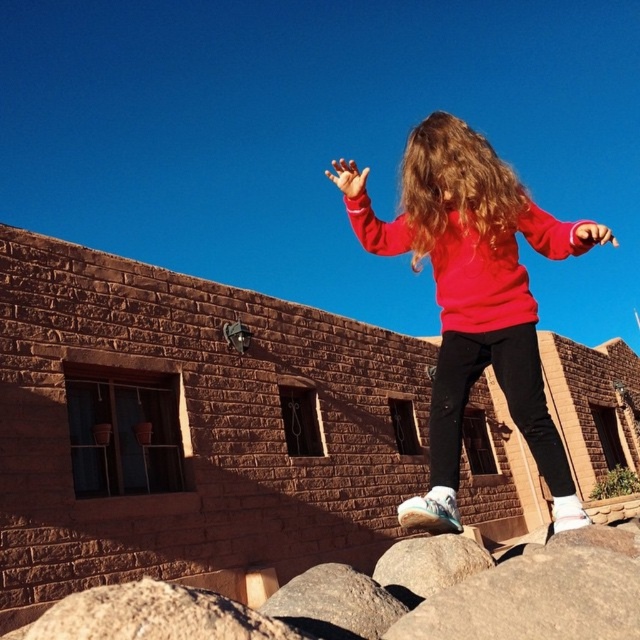
In the scene shown: Who is lower down, matte red sweatshirt at center or matte pink hand at upper right?

matte red sweatshirt at center is lower down.

Who is more forward, (538, 355) or (600, 234)?

Positioned in front is point (600, 234).

Where is `matte red sweatshirt at center`? matte red sweatshirt at center is located at coordinates (474, 301).

Between matte red sweatshirt at center and blonde silky hair at center, which one has more height?

blonde silky hair at center

Is matte red sweatshirt at center closer to the viewer compared to blonde silky hair at center?

Yes, it is.

Describe the element at coordinates (474, 301) in the screenshot. I see `matte red sweatshirt at center` at that location.

Where is `matte red sweatshirt at center`? The width and height of the screenshot is (640, 640). matte red sweatshirt at center is located at coordinates (474, 301).

Who is more distant from viewer, (413, 180) or (611, 234)?

The point (413, 180) is more distant.

Looking at this image, between blonde silky hair at center and matte pink hand at upper right, which one is positioned higher?

matte pink hand at upper right

Between point (438, 124) and point (600, 236), which one is positioned in front?

Point (600, 236) is more forward.

Find the location of a particular element. blonde silky hair at center is located at coordinates (456, 184).